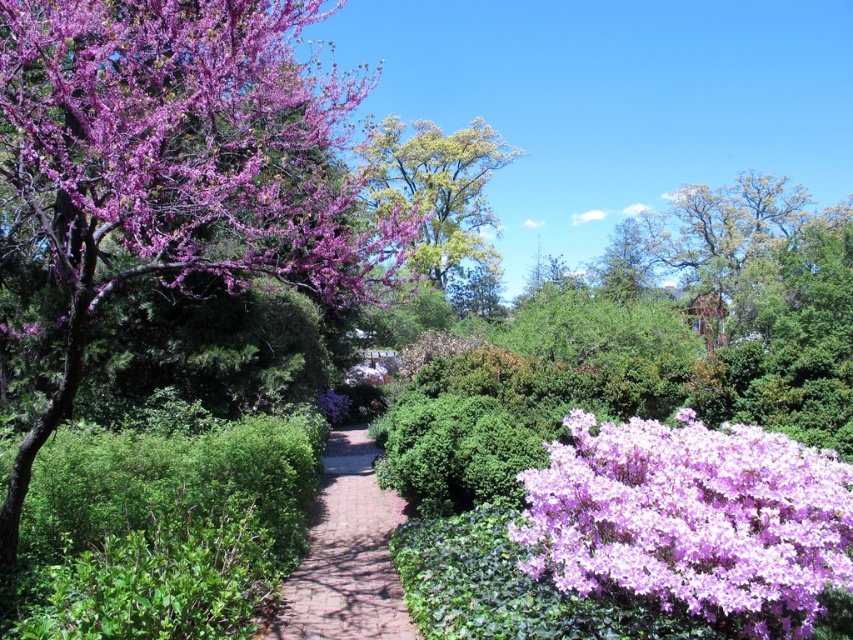
Question: Which point appears farthest from the camera in this image?

Choices:
 (A) (521, 522)
 (B) (317, 512)
 (C) (236, 198)
 (D) (395, 202)

Answer: (D)

Question: Considering the relative positions of purple matte tree at upper left and purple matte flowers at lower right in the image provided, where is purple matte tree at upper left located with respect to purple matte flowers at lower right?

Choices:
 (A) below
 (B) above

Answer: (B)

Question: Which point is farther to the camera?

Choices:
 (A) purple matte tree at upper left
 (B) brick paved path at center
 (C) green leafy tree at center

Answer: (C)

Question: Estimate the real-world distances between objects in this image. Which object is closer to the green leafy tree at center?

Choices:
 (A) purple matte tree at upper left
 (B) purple matte flowers at lower right
 (C) brick paved path at center

Answer: (A)

Question: Does brick paved path at center have a smaller size compared to green leafy tree at center?

Choices:
 (A) no
 (B) yes

Answer: (B)

Question: Is purple matte tree at upper left behind purple matte flowers at lower right?

Choices:
 (A) yes
 (B) no

Answer: (A)